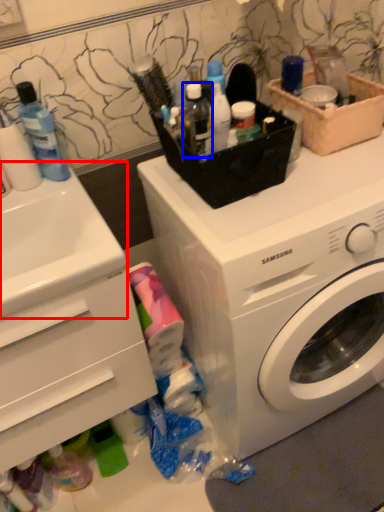
Question: Which of the following is the closest to the observer, sink (highlighted by a red box) or toiletry (highlighted by a blue box)?

Choices:
 (A) sink
 (B) toiletry

Answer: (A)